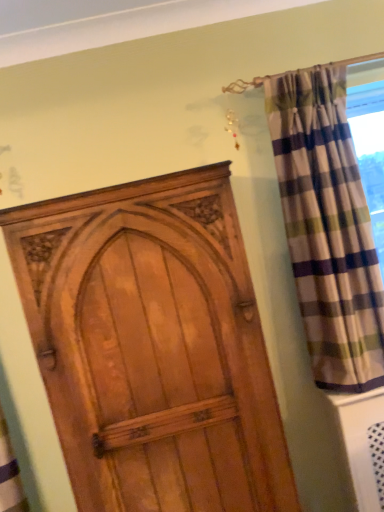
Question: From a real-world perspective, is plaid fabric curtain at right beneath wooden door at center?

Choices:
 (A) no
 (B) yes

Answer: (A)

Question: Are plaid fabric curtain at right and wooden door at center located far from each other?

Choices:
 (A) no
 (B) yes

Answer: (A)

Question: Does plaid fabric curtain at right have a greater width compared to wooden door at center?

Choices:
 (A) no
 (B) yes

Answer: (A)

Question: Is plaid fabric curtain at right beside wooden door at center?

Choices:
 (A) yes
 (B) no

Answer: (B)

Question: Is plaid fabric curtain at right surrounding wooden door at center?

Choices:
 (A) yes
 (B) no

Answer: (B)

Question: Considering the relative sizes of plaid fabric curtain at right and wooden door at center in the image provided, is plaid fabric curtain at right thinner than wooden door at center?

Choices:
 (A) yes
 (B) no

Answer: (A)

Question: Is wooden door at center positioned in front of plaid fabric curtain at right?

Choices:
 (A) no
 (B) yes

Answer: (B)

Question: Is plaid fabric curtain at right at the back of wooden door at center?

Choices:
 (A) yes
 (B) no

Answer: (B)

Question: From the image's perspective, does wooden door at center appear higher than plaid fabric curtain at right?

Choices:
 (A) no
 (B) yes

Answer: (A)

Question: Would you consider wooden door at center to be distant from plaid fabric curtain at right?

Choices:
 (A) yes
 (B) no

Answer: (B)

Question: From a real-world perspective, is wooden door at center positioned over plaid fabric curtain at right based on gravity?

Choices:
 (A) yes
 (B) no

Answer: (B)

Question: Considering the relative sizes of wooden door at center and plaid fabric curtain at right in the image provided, is wooden door at center bigger than plaid fabric curtain at right?

Choices:
 (A) no
 (B) yes

Answer: (B)

Question: In terms of size, does wooden door at center appear bigger or smaller than plaid fabric curtain at right?

Choices:
 (A) small
 (B) big

Answer: (B)